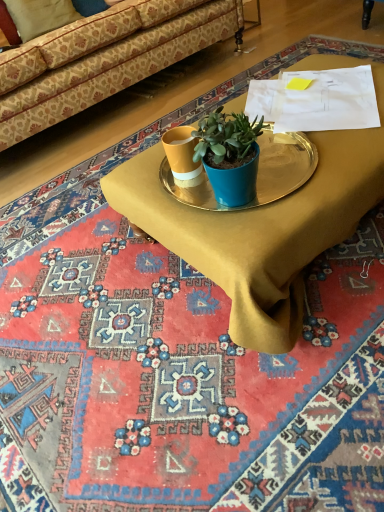
The width and height of the screenshot is (384, 512). I want to click on free space to the left of metallic gold tray at center, so [72, 289].